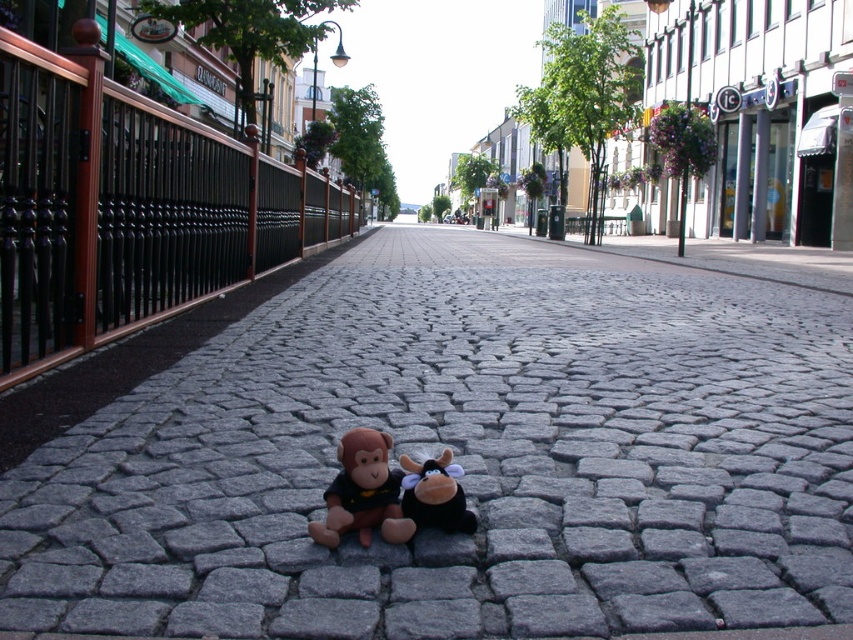
Is point (337, 284) farther from camera compared to point (415, 502)?

Yes, it is behind point (415, 502).

Is gray cobblestone pavement at center below black plush toy at center?

Yes, gray cobblestone pavement at center is below black plush toy at center.

Does point (434, 365) lie in front of point (463, 493)?

No, (434, 365) is further to viewer.

The height and width of the screenshot is (640, 853). I want to click on gray cobblestone pavement at center, so click(462, 458).

Which is behind, point (234, 372) or point (341, 480)?

The point (234, 372) is more distant.

The image size is (853, 640). What do you see at coordinates (462, 458) in the screenshot?
I see `gray cobblestone pavement at center` at bounding box center [462, 458].

Is point (663, 380) in front of point (351, 432)?

No, (663, 380) is further to viewer.

I want to click on gray cobblestone pavement at center, so click(462, 458).

Does brown plush monkey at center come behind black plush toy at center?

That is False.

Measure the distance between point (368, 488) and camera.

1.43 meters

Describe the element at coordinates (363, 492) in the screenshot. This screenshot has width=853, height=640. I see `brown plush monkey at center` at that location.

You are a GUI agent. You are given a task and a screenshot of the screen. Output one action in this format:
    pyautogui.click(x=<x>, y=<y>)
    Task: Click on the brown plush monkey at center
    The width and height of the screenshot is (853, 640).
    Given the screenshot: What is the action you would take?
    pyautogui.click(x=363, y=492)